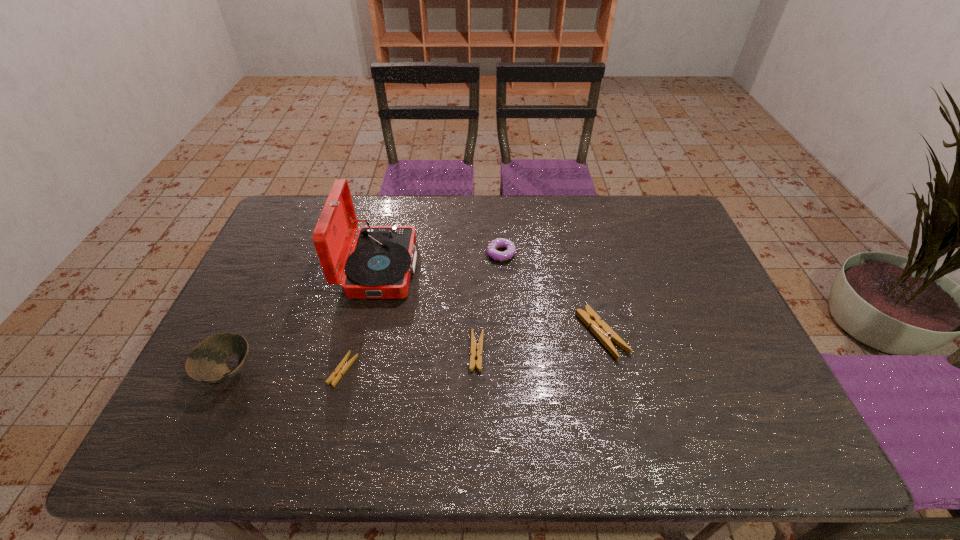
The height and width of the screenshot is (540, 960). I want to click on free area in between the doughnut and the fourth object from left to right, so click(489, 302).

The image size is (960, 540). In order to click on vacant space that is in between the doughnut and the second clothespin from right to left in this screenshot , I will do `click(489, 302)`.

You are a GUI agent. You are given a task and a screenshot of the screen. Output one action in this format:
    pyautogui.click(x=<x>, y=<y>)
    Task: Click on the empty space between the second object from right to left and the fifth shortest object
    Image resolution: width=960 pixels, height=540 pixels.
    Given the screenshot: What is the action you would take?
    point(365,313)

Image resolution: width=960 pixels, height=540 pixels. I want to click on free point between the rightmost object and the fourth shortest object, so click(x=551, y=294).

Locate an element on the screen. This screenshot has width=960, height=540. free area in between the fifth tallest object and the shortest object is located at coordinates (410, 361).

Identify the location of empty space between the fifth tallest object and the tallest clothespin. (540, 343).

Identify which object is located as the nearest to the second object from right to left. Please provide its 2D coordinates. Your answer should be formatted as a tuple, i.e. [(x, y)], where the tuple contains the x and y coordinates of a point satisfying the conditions above.

[(382, 258)]

You are a GUI agent. You are given a task and a screenshot of the screen. Output one action in this format:
    pyautogui.click(x=<x>, y=<y>)
    Task: Click on the third closest object to the rightmost clothespin
    The image size is (960, 540).
    Given the screenshot: What is the action you would take?
    pyautogui.click(x=382, y=258)

At what (x,y) coordinates should I click in order to perform the action: click on the second closest clothespin to the second clothespin from right to left. Please return your answer as a coordinate pair (x, y). The image size is (960, 540). Looking at the image, I should click on (343, 366).

The height and width of the screenshot is (540, 960). What are the coordinates of `clothespin that stands as the second closest to the leftmost clothespin` in the screenshot? It's located at (588, 316).